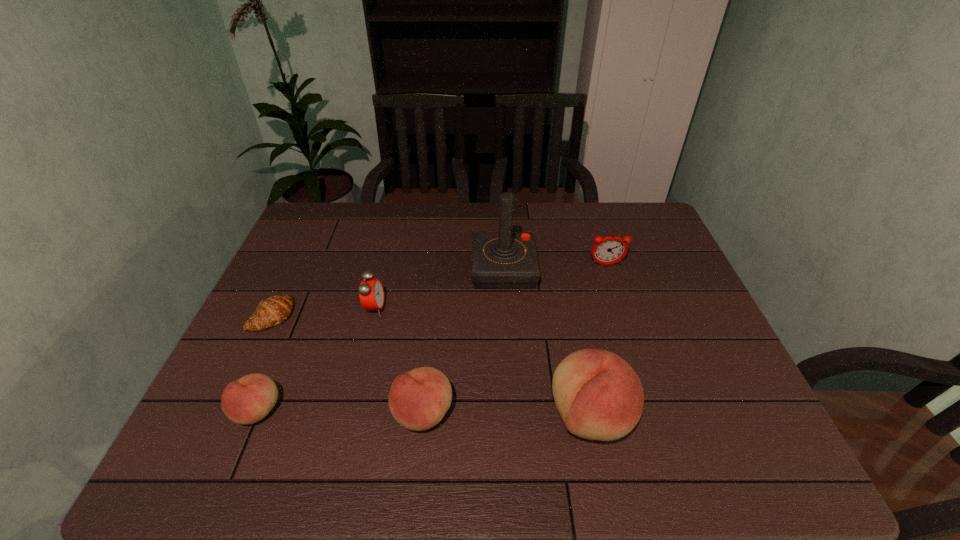
The image size is (960, 540). Find the location of `the shortest peach`. the shortest peach is located at coordinates (249, 399).

At what (x,y) coordinates should I click in order to perform the action: click on the leftmost peach. Please return your answer as a coordinate pair (x, y). Looking at the image, I should click on (249, 399).

Identify the location of the second peach from right to left. (418, 400).

At what (x,y) coordinates should I click in order to perform the action: click on the fourth object from left to right. Please return your answer as a coordinate pair (x, y). Looking at the image, I should click on (418, 400).

This screenshot has height=540, width=960. Find the location of `the rightmost peach`. the rightmost peach is located at coordinates (599, 396).

You are a GUI agent. You are given a task and a screenshot of the screen. Output one action in this format:
    pyautogui.click(x=<x>, y=<y>)
    Task: Click on the sixth shortest object
    This screenshot has height=540, width=960.
    Given the screenshot: What is the action you would take?
    pyautogui.click(x=599, y=396)

Identify the location of the right alarm clock. (609, 250).

At what (x,y) coordinates should I click in order to perform the action: click on the tallest object. Please return your answer as a coordinate pair (x, y). The image size is (960, 540). Looking at the image, I should click on (505, 260).

At what (x,y) coordinates should I click in order to perform the action: click on the nearer alarm clock. Please return your answer as a coordinate pair (x, y). The height and width of the screenshot is (540, 960). Looking at the image, I should click on (371, 293).

At what (x,y) coordinates should I click in order to perform the action: click on the left alarm clock. Please return your answer as a coordinate pair (x, y). Looking at the image, I should click on (371, 293).